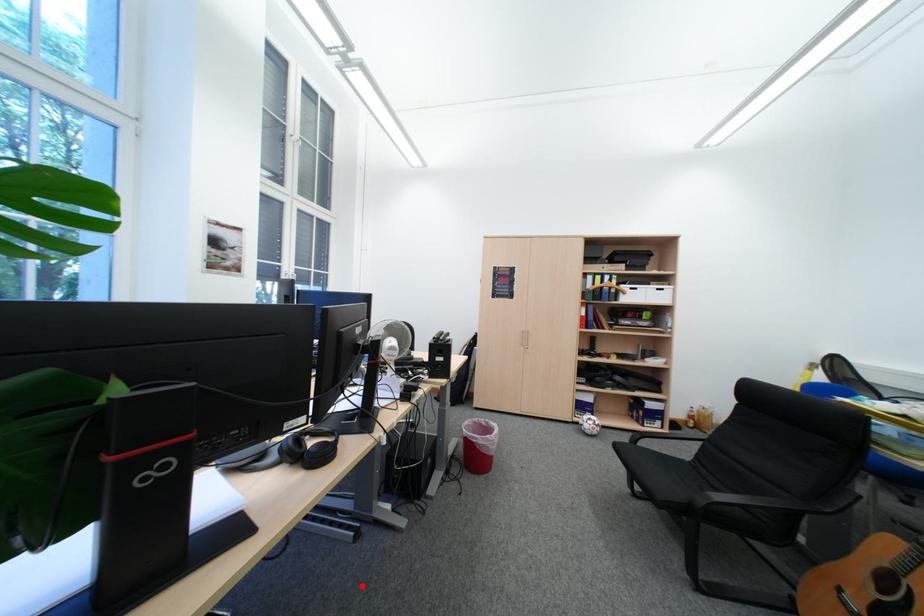
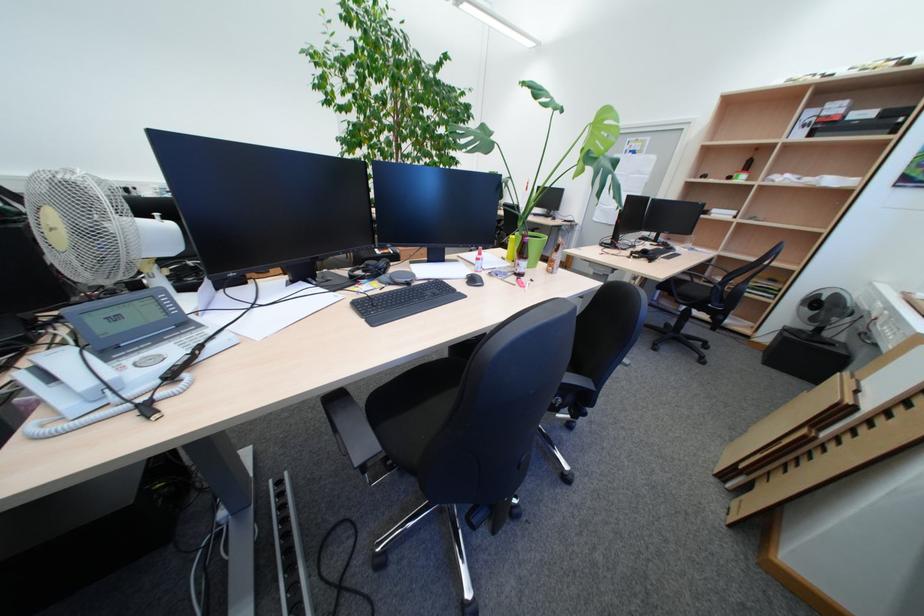
Question: I am providing you with two images of the same scene from different viewpoints. Given a red point in image1, look at the same physical point in image2. Is it:

Choices:
 (A) Closer to the viewpoint
 (B) Farther from the viewpoint

Answer: (B)